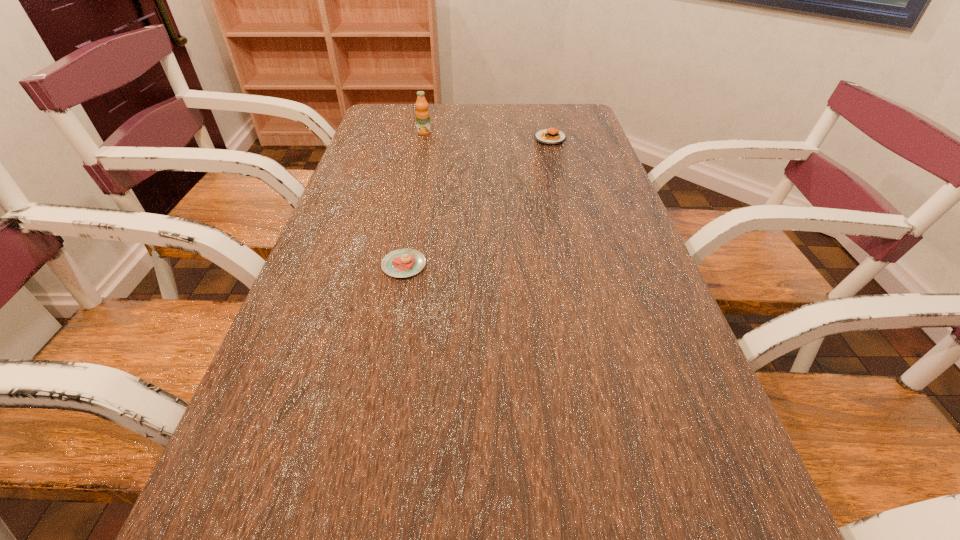
This screenshot has width=960, height=540. Find the location of `object at the left edge`. object at the left edge is located at coordinates (400, 263).

In order to click on object present at the right edge in this screenshot , I will do `click(551, 136)`.

Find the location of a particular element. The width and height of the screenshot is (960, 540). object at the far right corner is located at coordinates (551, 136).

In order to click on blank space at the far edge of the desktop in this screenshot , I will do `click(533, 113)`.

In the image, there is a desktop. At what (x,y) coordinates should I click in order to perform the action: click on free space at the left edge. Please return your answer as a coordinate pair (x, y). Image resolution: width=960 pixels, height=540 pixels. Looking at the image, I should click on (257, 489).

Identify the location of free region at the right edge of the desktop. (662, 379).

In the image, there is a desktop. Identify the location of vacant space at the far left corner. (375, 129).

What are the coordinates of `blank space at the far right corner of the desktop` in the screenshot? It's located at (566, 115).

This screenshot has height=540, width=960. What are the coordinates of `empty space that is in between the second tallest object and the tallest object` in the screenshot? It's located at (487, 136).

Find the location of a particular element. Image resolution: width=960 pixels, height=540 pixels. empty space that is in between the tallest object and the rightmost object is located at coordinates (487, 136).